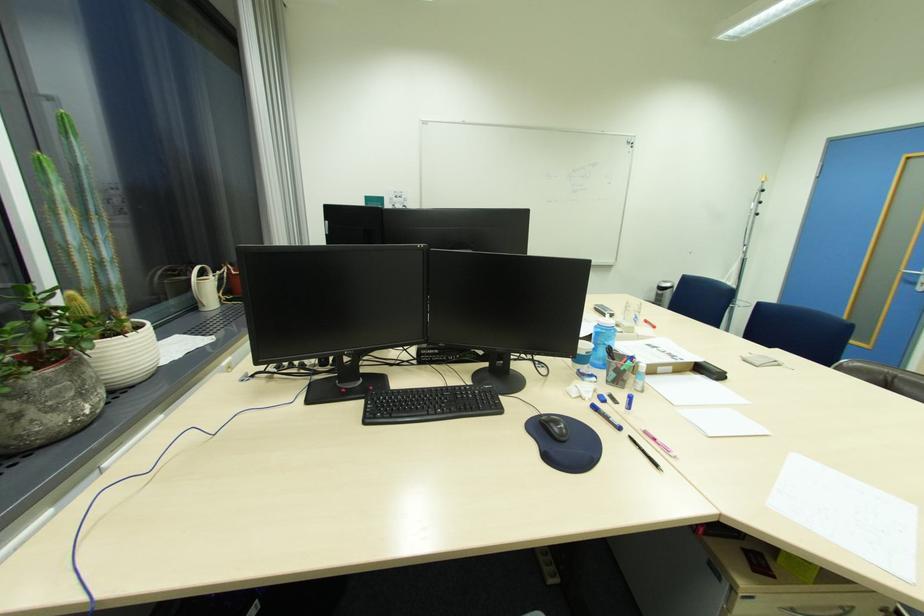
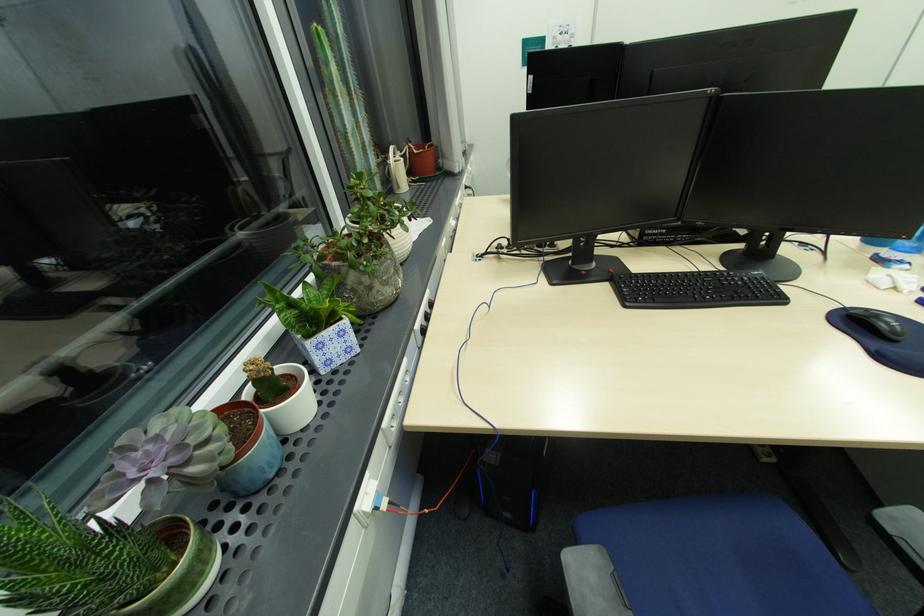
In the second image, find the point that corresponds to pixel 546 416 in the first image.

(849, 310)